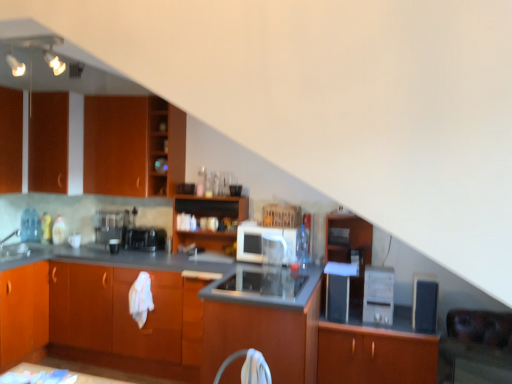
Question: Is wooden cabinet at center, placed as the 4th appliance when sorted from left to right, situated inside wooden file cabinet at center or outside?

Choices:
 (A) outside
 (B) inside

Answer: (A)

Question: From a real-world perspective, relative to wooden file cabinet at center, is wooden cabinet at center, placed as the 4th appliance when sorted from left to right, vertically above or below?

Choices:
 (A) above
 (B) below

Answer: (B)

Question: Estimate the real-world distances between objects in this image. Which object is closer to the wooden shelves at upper left?

Choices:
 (A) wooden cabinet at center, which appears as the 2th appliance when viewed from the right
 (B) wooden cabinets at center, which ranks as the 4th cabinetry in left-to-right order
 (C) wooden cabinet at center, which is the 2th cabinetry from right to left
 (D) matte wood cabinet at left, which appears as the first cabinetry when viewed from the left
 (E) white glossy sink at left

Answer: (B)

Question: Considering the real-world distances, which object is closest to the matte wood cabinet at left, which appears as the first cabinetry when viewed from the left?

Choices:
 (A) black plastic coffee maker at center, which appears as the 1th appliance when viewed from the left
 (B) matte wood cabinets at upper left, which is the seventh cabinetry from right to left
 (C) sleek stainless steel stove at center, which is counted as the fourth appliance, starting from the right
 (D) satin black coffee machine at center
 (E) wooden shelves at upper left

Answer: (B)